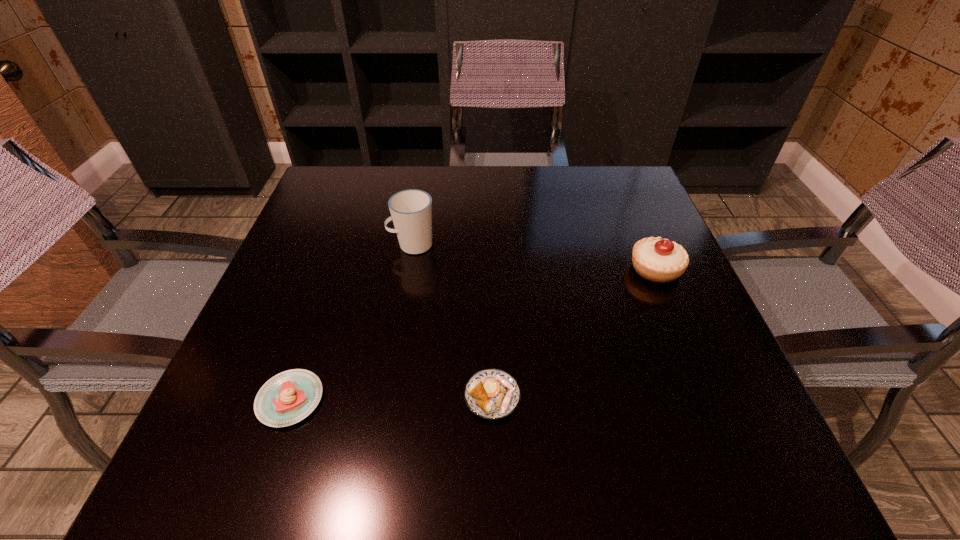
The image size is (960, 540). Identify the location of vacant region located 0.230m on the back of the second object from right to left. (490, 282).

At what (x,y) coordinates should I click in order to perform the action: click on free space located on the back of the leftmost pastry. Please return your answer as a coordinate pair (x, y). This screenshot has width=960, height=540. Looking at the image, I should click on (323, 306).

This screenshot has height=540, width=960. Find the location of `object that is at the left edge`. object that is at the left edge is located at coordinates (287, 398).

Identify the location of object at the right edge. (660, 260).

The width and height of the screenshot is (960, 540). What are the coordinates of `vacant space at the far edge` in the screenshot? It's located at (525, 167).

Find the location of `free space at the near edge of the desktop`. free space at the near edge of the desktop is located at coordinates (502, 478).

This screenshot has width=960, height=540. In the image, there is a desktop. Identify the location of vacant area at the left edge. (325, 260).

Locate an element on the screen. free region at the right edge of the desktop is located at coordinates (702, 391).

Image resolution: width=960 pixels, height=540 pixels. In order to click on vacant space at the far left corner of the desktop in this screenshot , I will do `click(352, 207)`.

I want to click on vacant space at the near right corner of the desktop, so click(762, 470).